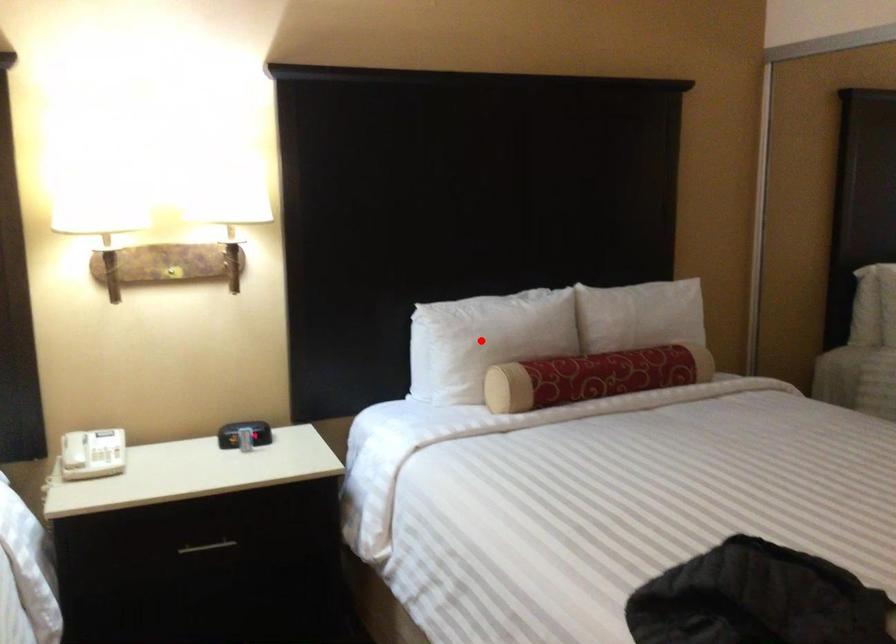
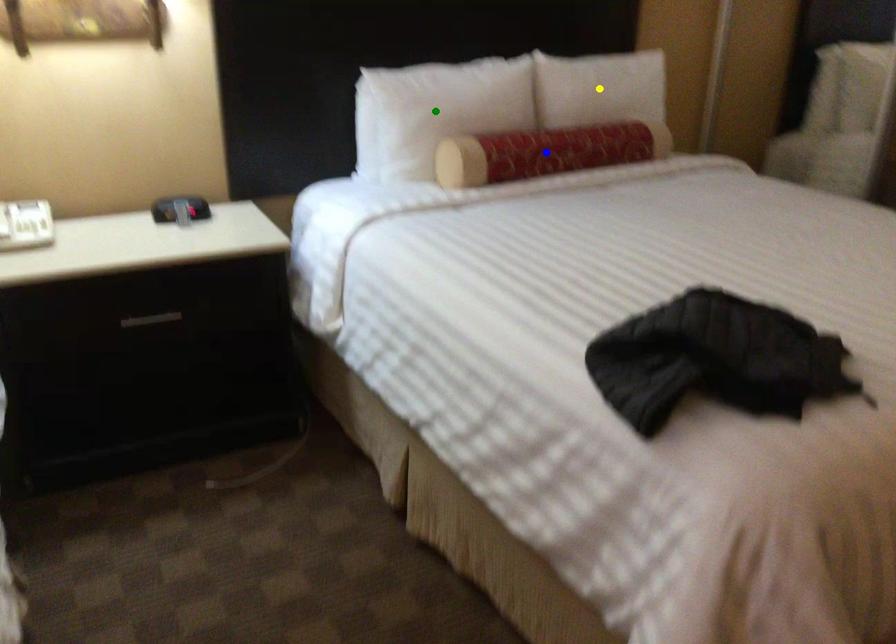
Question: I am providing you with two images of the same scene from different viewpoints. A red point is marked on the first image. You are given multiple points on the second image. Which point in image 2 represents the same 3d spot as the red point in image 1?

Choices:
 (A) blue point
 (B) green point
 (C) yellow point

Answer: (B)